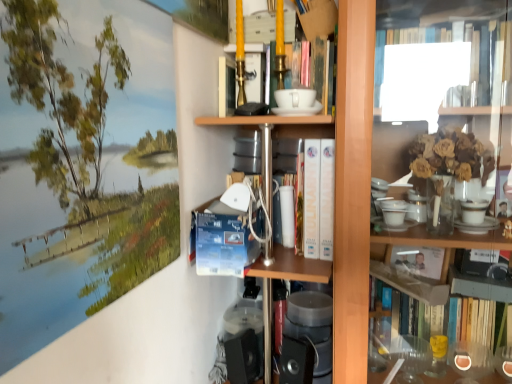
Question: Considering the positions of point (365, 49) and point (279, 150), is point (365, 49) closer or farther from the camera than point (279, 150)?

Choices:
 (A) farther
 (B) closer

Answer: (B)

Question: Based on their sizes in the image, would you say wooden bookcase at center is bigger or smaller than white paperback books at center?

Choices:
 (A) big
 (B) small

Answer: (A)

Question: Is wooden bookcase at center wider or thinner than white paperback books at center?

Choices:
 (A) thin
 (B) wide

Answer: (B)

Question: Looking at the image, does white paperback books at center seem bigger or smaller compared to wooden bookcase at center?

Choices:
 (A) big
 (B) small

Answer: (B)

Question: Is white paperback books at center in front of or behind wooden bookcase at center in the image?

Choices:
 (A) front
 (B) behind

Answer: (B)

Question: In the image, is white paperback books at center on the left side or the right side of wooden bookcase at center?

Choices:
 (A) left
 (B) right

Answer: (A)

Question: From the image's perspective, is white paperback books at center above or below wooden bookcase at center?

Choices:
 (A) above
 (B) below

Answer: (A)